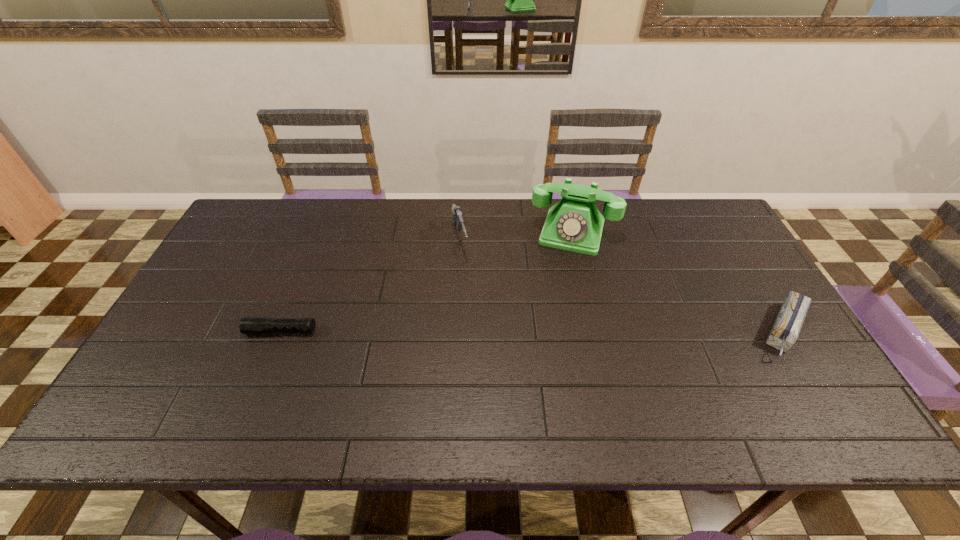
This screenshot has height=540, width=960. I want to click on the shortest object, so coord(248,325).

Image resolution: width=960 pixels, height=540 pixels. In order to click on the leftmost object in this screenshot , I will do `click(248, 325)`.

Find the location of `the third tallest object`. the third tallest object is located at coordinates (785, 331).

At what (x,y) coordinates should I click in order to perform the action: click on pencil box. Please return your answer as a coordinate pair (x, y). Looking at the image, I should click on (785, 331).

Find the location of `gun`. gun is located at coordinates (457, 217).

You are a GUI agent. You are given a task and a screenshot of the screen. Output one action in this format:
    pyautogui.click(x=<x>, y=<y>)
    Task: Click on the second tallest object
    Image resolution: width=960 pixels, height=540 pixels.
    Given the screenshot: What is the action you would take?
    pyautogui.click(x=457, y=217)

Identify the location of telephone. (574, 224).

What are the coordinates of `the second object from right to left` in the screenshot? It's located at (574, 224).

This screenshot has width=960, height=540. What are the coordinates of `blank space located at the lens end of the shortest object` in the screenshot? It's located at (201, 331).

Find the location of `vacant point located 0.120m at the lens end of the shortest object`. vacant point located 0.120m at the lens end of the shortest object is located at coordinates (201, 331).